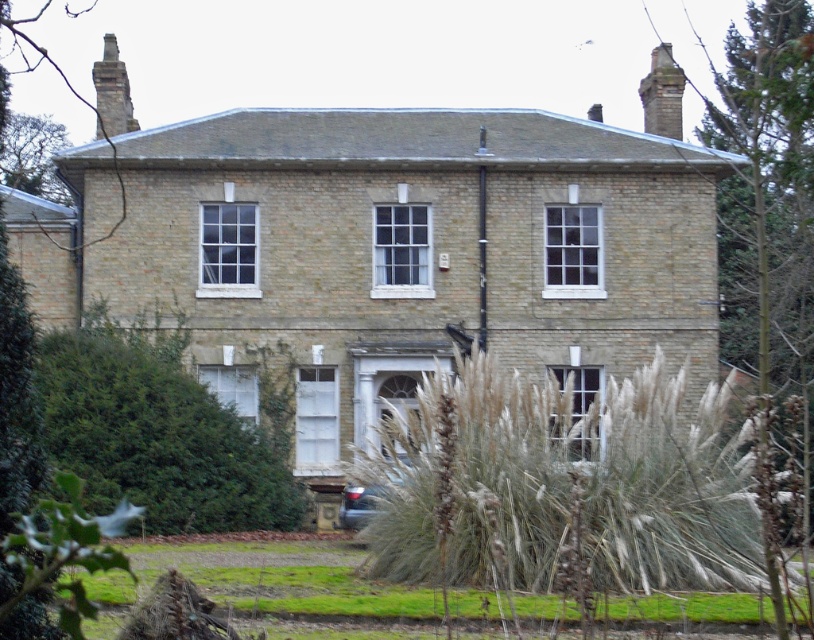
You are standing in front of the house and notice two points marked on the facade. The first point is at coordinate (667,70) and the second at (357,486). Which point is closer to you?

Point (357,486) is closer to you because it is less further to the camera than point (667,70).